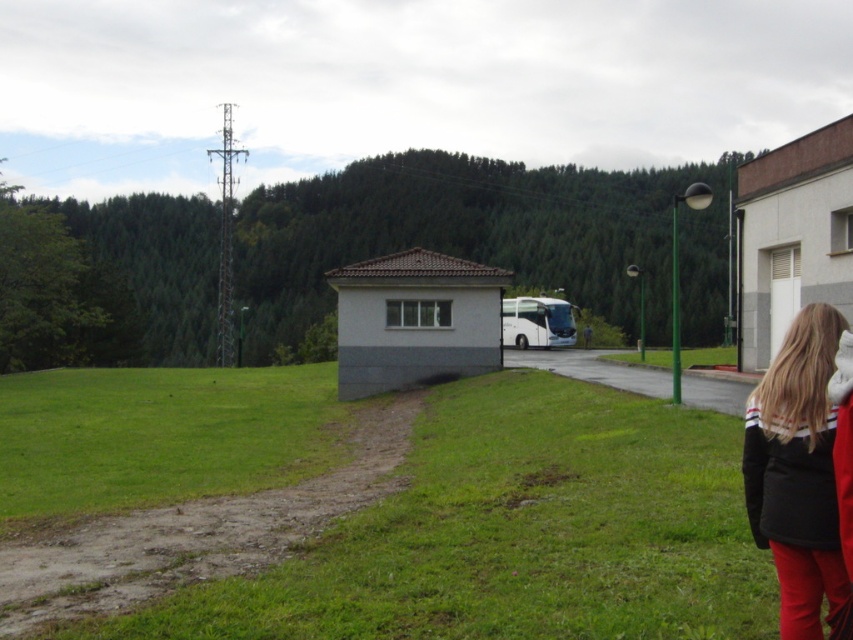
Between black fleece jacket at lower right and white glossy bus at center, which one appears on the left side from the viewer's perspective?

black fleece jacket at lower right is more to the left.

Which is below, black fleece jacket at lower right or white glossy bus at center?

Positioned lower is black fleece jacket at lower right.

Does point (773, 428) come closer to viewer compared to point (567, 330)?

Yes, it is.

The image size is (853, 640). I want to click on black fleece jacket at lower right, so click(798, 470).